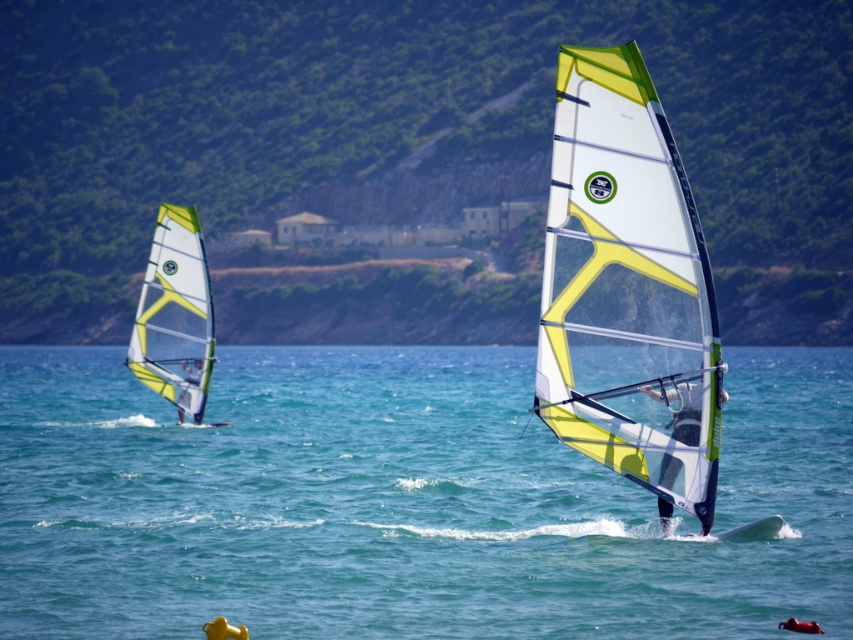
Who is higher up, green leafy hillside at upper center or matte white windsurfing board at left?

green leafy hillside at upper center is higher up.

Can you confirm if green leafy hillside at upper center is positioned to the left of matte white windsurfing board at left?

Incorrect, green leafy hillside at upper center is not on the left side of matte white windsurfing board at left.

The height and width of the screenshot is (640, 853). In order to click on green leafy hillside at upper center in this screenshot , I will do `click(401, 156)`.

Based on the photo, is green leafy hillside at upper center taller than transparent water at center?

Correct, green leafy hillside at upper center is much taller as transparent water at center.

Between point (16, 28) and point (473, 348), which one is positioned in front?

Point (473, 348) is in front.

I want to click on green leafy hillside at upper center, so click(401, 156).

Is transparent water at center to the left of matte white windsurfing board at left from the viewer's perspective?

Incorrect, transparent water at center is not on the left side of matte white windsurfing board at left.

Between transparent water at center and matte white windsurfing board at left, which one is positioned lower?

matte white windsurfing board at left

I want to click on transparent water at center, so click(402, 500).

Where is `transparent water at center`? The height and width of the screenshot is (640, 853). transparent water at center is located at coordinates (402, 500).